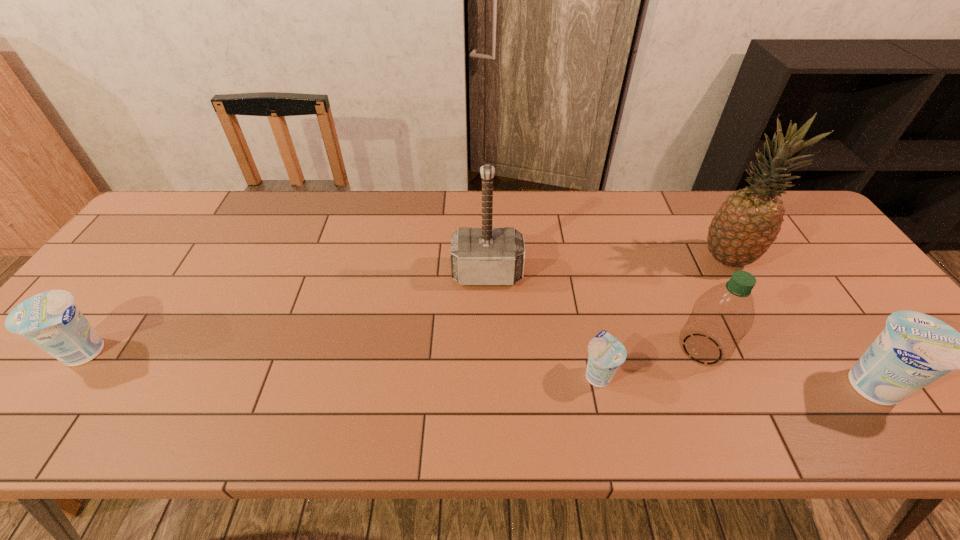
I want to click on free space that satisfies the following two spatial constraints: 1. on the back side of the third tallest object; 2. on the right side of the pineapple, so click(664, 259).